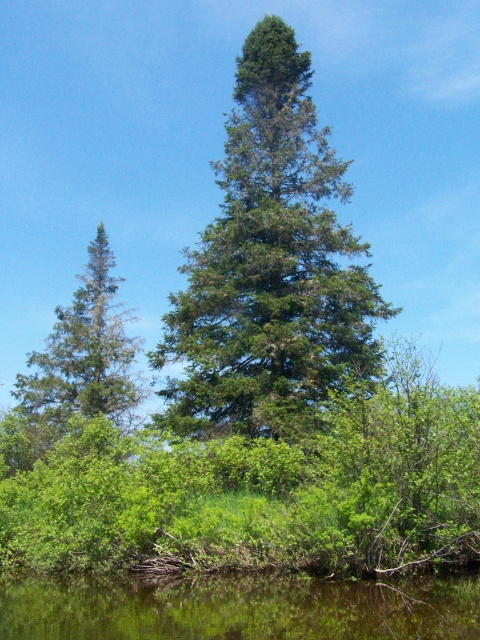
Is green reflective water at lower center bigger than green needle-like at left?

Incorrect, green reflective water at lower center is not larger than green needle-like at left.

Where is `green reflective water at lower center`? Image resolution: width=480 pixels, height=640 pixels. green reflective water at lower center is located at coordinates (238, 609).

Image resolution: width=480 pixels, height=640 pixels. In order to click on green reflective water at lower center in this screenshot , I will do `click(238, 609)`.

Is green needle-like at center shorter than green needle-like at left?

No, green needle-like at center is not shorter than green needle-like at left.

Between green needle-like at center and green needle-like at left, which one appears on the right side from the viewer's perspective?

green needle-like at center

Identify the location of green needle-like at center. The image size is (480, 640). (269, 266).

This screenshot has width=480, height=640. In order to click on green needle-like at center in this screenshot , I will do `click(269, 266)`.

Consider the image. Does green needle-like at center have a greater width compared to green reflective water at lower center?

No, green needle-like at center is not wider than green reflective water at lower center.

Can you confirm if green needle-like at center is bigger than green reflective water at lower center?

Indeed, green needle-like at center has a larger size compared to green reflective water at lower center.

Measure the distance between point (292, 385) and camera.

Point (292, 385) is 89.79 feet away from camera.

This screenshot has width=480, height=640. Find the location of `green needle-like at center`. green needle-like at center is located at coordinates (269, 266).